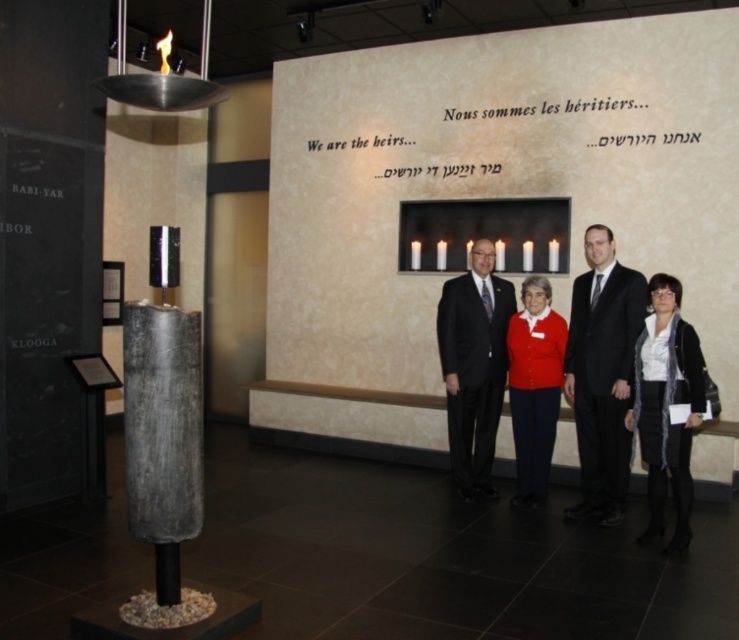
You are a photographer taking a group photo of the matte black suit at center and the matte red sweater at center. Which clothing item will appear larger in the photo?

The matte black suit at center will appear larger in the photo because it is bigger than the matte red sweater at center.

You are a photographer positioned in front of the group. You want to take a photo focusing on the black suit at center and the matte red sweater at center. Which one will appear larger in the photo?

The black suit at center will appear larger in the photo because it is closer to the viewer than the matte red sweater at center.

You are a photographer at the museum and need to capture a photo of the matte black suit at center and the matte red sweater at center. Which one should you zoom in on to ensure it fills the frame appropriately?

The matte black suit at center has a larger width than the matte red sweater at center, so you should zoom in on the matte red sweater at center to ensure it fills the frame appropriately.